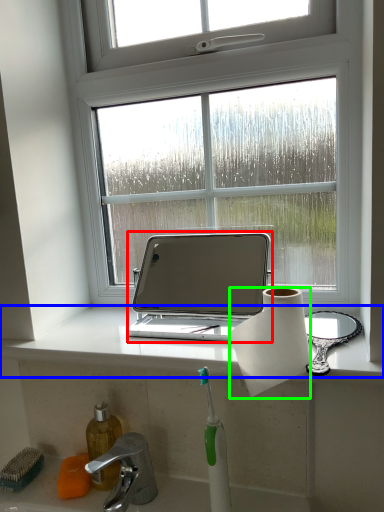
Question: Considering the real-world distances, which object is farthest from laptop (highlighted by a red box)? window sill (highlighted by a blue box) or paper towel (highlighted by a green box)?

Choices:
 (A) window sill
 (B) paper towel

Answer: (B)